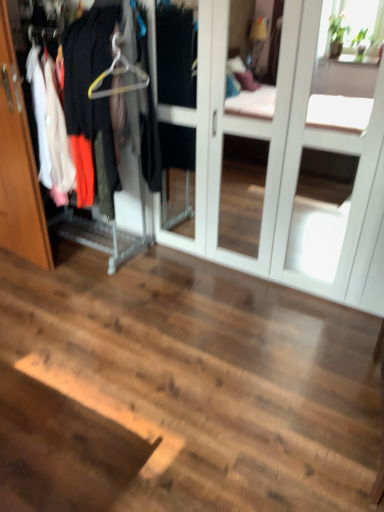
This screenshot has width=384, height=512. What do you see at coordinates (18, 164) in the screenshot?
I see `wooden door at left` at bounding box center [18, 164].

What is the approximate height of metallic hanger at left?

metallic hanger at left is 4.86 feet tall.

The image size is (384, 512). What do you see at coordinates (305, 151) in the screenshot?
I see `white glossy screen door at center` at bounding box center [305, 151].

Identify the location of wooden door at left. (18, 164).

Does metallic hanger at left have a smaller size compared to wooden door at left?

Actually, metallic hanger at left might be larger than wooden door at left.

In the scene shown: Is metallic hanger at left oriented away from wooden door at left?

Yes, metallic hanger at left's orientation is away from wooden door at left.

You are a GUI agent. You are given a task and a screenshot of the screen. Output one action in this format:
    pyautogui.click(x=<x>, y=<y>)
    Task: Click on the closet in front of the wooden door at left
    The image size is (384, 512).
    Given the screenshot: What is the action you would take?
    pyautogui.click(x=18, y=164)

Which of these two, wooden door at left or yellow plastic hanger at upper left, is bigger?

With larger size is wooden door at left.

Is wooden door at left taller or shorter than yellow plastic hanger at upper left?

Considering their sizes, wooden door at left has more height than yellow plastic hanger at upper left.

Which object is more forward, wooden door at left or yellow plastic hanger at upper left?

Positioned in front is yellow plastic hanger at upper left.

From the image's perspective, is wooden door at left located beneath yellow plastic hanger at upper left?

Yes.

Is metallic hanger at left not inside yellow plastic hanger at upper left?

metallic hanger at left lies outside yellow plastic hanger at upper left's area.

Looking at their sizes, would you say metallic hanger at left is wider or thinner than yellow plastic hanger at upper left?

A: metallic hanger at left is wider than yellow plastic hanger at upper left.

Which object is positioned more to the left, metallic hanger at left or yellow plastic hanger at upper left?

Positioned to the left is metallic hanger at left.

Is metallic hanger at left beside white glossy screen door at center?

No, metallic hanger at left is not making contact with white glossy screen door at center.

Is metallic hanger at left positioned with its back to white glossy screen door at center?

Yes, white glossy screen door at center is at the back of metallic hanger at left.

Is point (14, 88) behind point (303, 274)?

No, (14, 88) is in front of (303, 274).

Is metallic hanger at left surrounding white glossy screen door at center?

Definitely not — white glossy screen door at center is not inside metallic hanger at left.

Does point (5, 48) lie in front of point (359, 269)?

Yes.

From a real-world perspective, is wooden door at left on top of white glossy screen door at center?

No, from a real-world perspective, wooden door at left is not above white glossy screen door at center.

From the image's perspective, is wooden door at left located above or below white glossy screen door at center?

Based on their image positions, wooden door at left is located beneath white glossy screen door at center.

Is point (130, 68) closer or farther from the camera than point (28, 212)?

Point (130, 68) is closer to the camera than point (28, 212).

Is the depth of yellow plastic hanger at upper left less than that of metallic hanger at left?

No.

Is the surface of yellow plastic hanger at upper left in direct contact with metallic hanger at left?

They are not placed beside each other.

Considering the relative sizes of yellow plastic hanger at upper left and metallic hanger at left in the image provided, is yellow plastic hanger at upper left smaller than metallic hanger at left?

Yes, yellow plastic hanger at upper left is smaller than metallic hanger at left.

Does point (313, 255) come farther from viewer compared to point (49, 263)?

That is True.

Is white glossy screen door at center positioned with its back to metallic hanger at left?

That's not correct — white glossy screen door at center is not looking away from metallic hanger at left.

What's the angular difference between white glossy screen door at center and metallic hanger at left's facing directions?

1.95 degrees separate the facing orientations of white glossy screen door at center and metallic hanger at left.

The image size is (384, 512). I want to click on closet above the white glossy screen door at center (from a real-world perspective), so click(x=18, y=164).

You are a GUI agent. You are given a task and a screenshot of the screen. Output one action in this format:
    pyautogui.click(x=<x>, y=<y>)
    Task: Click on the closet in front of the wooden door at left
    The image size is (384, 512).
    Given the screenshot: What is the action you would take?
    pyautogui.click(x=18, y=164)

Where is `door to the left of yellow plastic hanger at upper left`? This screenshot has height=512, width=384. door to the left of yellow plastic hanger at upper left is located at coordinates (18, 164).

Estimate the real-world distances between objects in this image. Which object is closer to wooden door at left, metallic hanger at left or white glossy screen door at center?

metallic hanger at left lies closer to wooden door at left than the other object.

Estimate the real-world distances between objects in this image. Which object is further from wooden door at left, yellow plastic hanger at upper left or white glossy screen door at center?

Among the two, white glossy screen door at center is located further to wooden door at left.

Which object lies nearer to the anchor point white glossy screen door at center, yellow plastic hanger at upper left or metallic hanger at left?

yellow plastic hanger at upper left lies closer to white glossy screen door at center than the other object.

When comparing their distances from yellow plastic hanger at upper left, does metallic hanger at left or wooden door at left seem closer?

metallic hanger at left.

Looking at the image, which one is located closer to wooden door at left, metallic hanger at left or yellow plastic hanger at upper left?

Based on the image, metallic hanger at left appears to be nearer to wooden door at left.

From the image, which object appears to be farther from metallic hanger at left, white glossy screen door at center or yellow plastic hanger at upper left?

white glossy screen door at center.

Based on their spatial positions, is metallic hanger at left or yellow plastic hanger at upper left closer to white glossy screen door at center?

yellow plastic hanger at upper left lies closer to white glossy screen door at center than the other object.

Estimate the real-world distances between objects in this image. Which object is closer to metallic hanger at left, wooden door at left or yellow plastic hanger at upper left?

wooden door at left is closer to metallic hanger at left.

Locate an element on the screen. closet between wooden door at left and white glossy screen door at center from left to right is located at coordinates (18, 164).

Where is `hanger located between metallic hanger at left and white glossy screen door at center in the left-right direction`? The height and width of the screenshot is (512, 384). hanger located between metallic hanger at left and white glossy screen door at center in the left-right direction is located at coordinates (118, 73).

This screenshot has width=384, height=512. Identify the location of closet between wooden door at left and yellow plastic hanger at upper left in the horizontal direction. (18, 164).

Locate an element on the screen. hanger between wooden door at left and white glossy screen door at center in the horizontal direction is located at coordinates (118, 73).